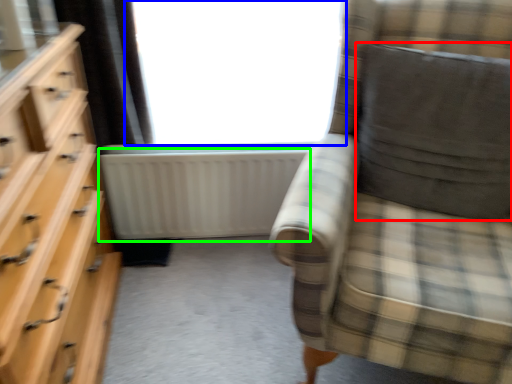
Question: Which is farther away from pillow (highlighted by a red box)? window (highlighted by a blue box) or radiator (highlighted by a green box)?

Choices:
 (A) window
 (B) radiator

Answer: (B)